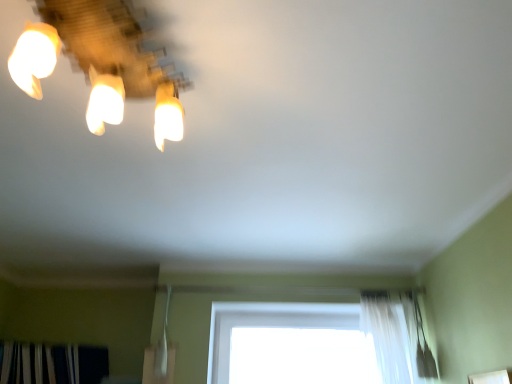
Question: Is matte glass lamp at upper left located outside dark green textured curtain at lower left?

Choices:
 (A) no
 (B) yes

Answer: (B)

Question: Does matte glass lamp at upper left have a smaller size compared to dark green textured curtain at lower left?

Choices:
 (A) no
 (B) yes

Answer: (B)

Question: Is matte glass lamp at upper left behind dark green textured curtain at lower left?

Choices:
 (A) yes
 (B) no

Answer: (B)

Question: Considering the relative sizes of matte glass lamp at upper left and dark green textured curtain at lower left in the image provided, is matte glass lamp at upper left thinner than dark green textured curtain at lower left?

Choices:
 (A) no
 (B) yes

Answer: (A)

Question: Can you confirm if matte glass lamp at upper left is wider than dark green textured curtain at lower left?

Choices:
 (A) no
 (B) yes

Answer: (B)

Question: Can you confirm if matte glass lamp at upper left is taller than dark green textured curtain at lower left?

Choices:
 (A) yes
 (B) no

Answer: (A)

Question: Can you confirm if white sheer curtain at lower right is smaller than dark green textured curtain at lower left?

Choices:
 (A) no
 (B) yes

Answer: (B)

Question: Is white sheer curtain at lower right closer to the viewer compared to dark green textured curtain at lower left?

Choices:
 (A) yes
 (B) no

Answer: (A)

Question: Is white sheer curtain at lower right aimed at dark green textured curtain at lower left?

Choices:
 (A) yes
 (B) no

Answer: (B)

Question: Would you say white sheer curtain at lower right is outside dark green textured curtain at lower left?

Choices:
 (A) no
 (B) yes

Answer: (B)

Question: From the image's perspective, is white sheer curtain at lower right on top of dark green textured curtain at lower left?

Choices:
 (A) no
 (B) yes

Answer: (B)

Question: Is white sheer curtain at lower right further to the viewer compared to dark green textured curtain at lower left?

Choices:
 (A) no
 (B) yes

Answer: (A)

Question: Can you confirm if white sheer curtain at lower right is positioned to the right of matte glass lamp at upper left?

Choices:
 (A) no
 (B) yes

Answer: (B)